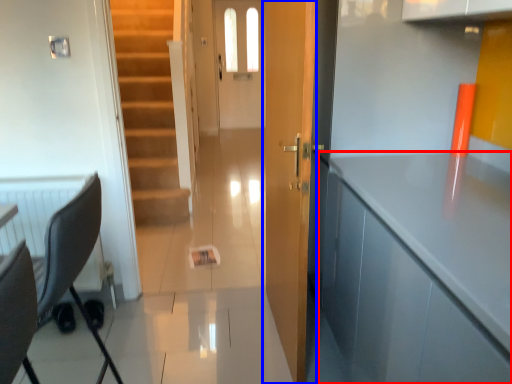
Question: Which object is further to the camera taking this photo, cabinetry (highlighted by a red box) or door (highlighted by a blue box)?

Choices:
 (A) cabinetry
 (B) door

Answer: (B)